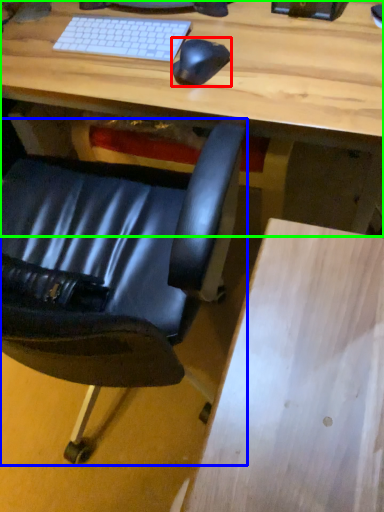
Question: Which object is positioned farthest from mouse (highlighted by a red box)? Select from chair (highlighted by a blue box) and desk (highlighted by a green box).

Choices:
 (A) chair
 (B) desk

Answer: (A)